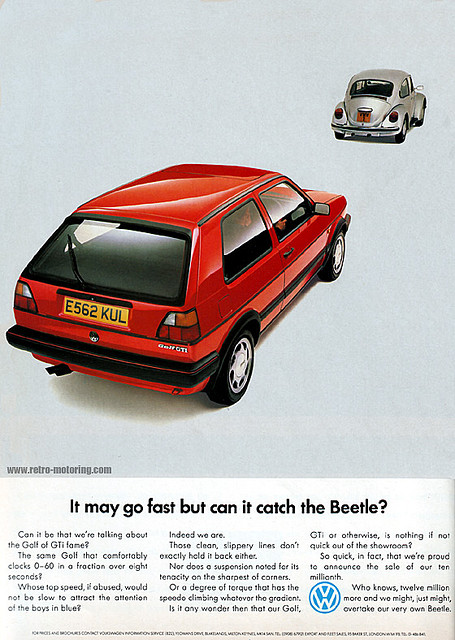
Find the location of a particular element. The height and width of the screenshot is (640, 455). door handle is located at coordinates (290, 250).